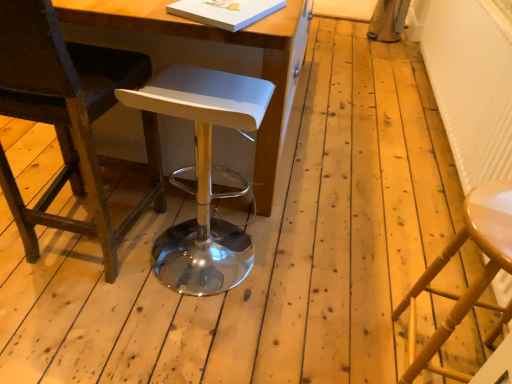
The height and width of the screenshot is (384, 512). Identify the location of free space that is in between dark brown leather chair at left and white plastic stool at center, acting as the second stool starting from the right. (146, 252).